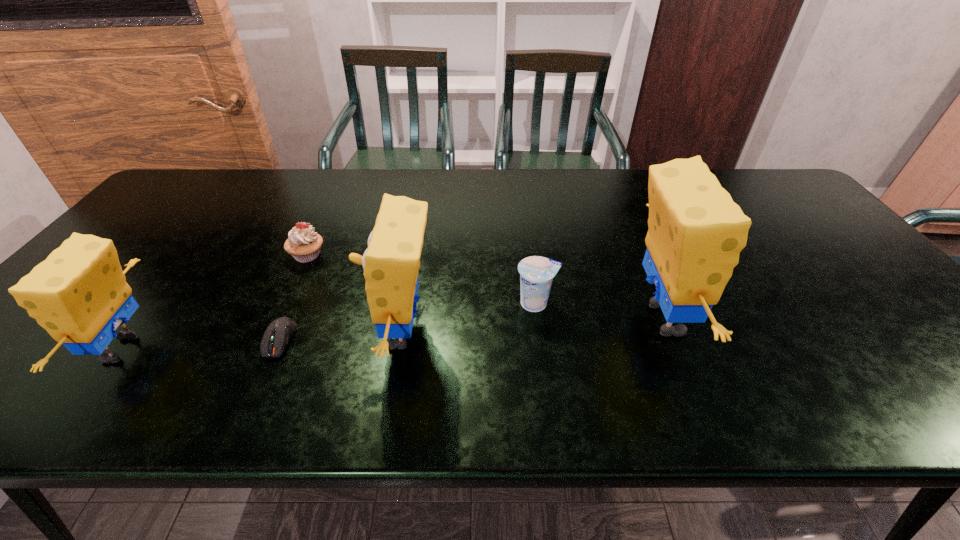
Where is `vacant space located 0.120m on the face of the leftmost object`? The height and width of the screenshot is (540, 960). vacant space located 0.120m on the face of the leftmost object is located at coordinates (38, 349).

The width and height of the screenshot is (960, 540). In order to click on vacant space located 0.360m on the face of the fifth shortest object in this screenshot , I will do `click(209, 333)`.

Find the location of a particular element. Image resolution: width=960 pixels, height=540 pixels. vacant region located on the face of the fifth shortest object is located at coordinates (196, 333).

Image resolution: width=960 pixels, height=540 pixels. I want to click on vacant position located 0.100m on the face of the fifth shortest object, so click(x=324, y=333).

This screenshot has width=960, height=540. What are the coordinates of `vacant region located on the face of the rightmost object` in the screenshot? It's located at (833, 319).

You are a GUI agent. You are given a task and a screenshot of the screen. Output one action in this format:
    pyautogui.click(x=<x>, y=<y>)
    Task: Click on the vacant space located 0.090m on the right of the cupcake
    The height and width of the screenshot is (540, 960).
    Given the screenshot: What is the action you would take?
    pyautogui.click(x=358, y=255)

Identify the location of vacant space located on the left of the yogurt. This screenshot has height=540, width=960. (478, 303).

What are the coordinates of `computer equipment at the near edge` in the screenshot? It's located at 279,332.

You are a GUI agent. You are given a task and a screenshot of the screen. Output one action in this format:
    pyautogui.click(x=<x>, y=<y>)
    Task: Click on the free spot at the far edge of the desktop
    Image resolution: width=960 pixels, height=540 pixels.
    Given the screenshot: What is the action you would take?
    pyautogui.click(x=611, y=173)

Find the location of a particular element. This screenshot has width=960, height=540. vacant point at the near edge is located at coordinates (179, 348).